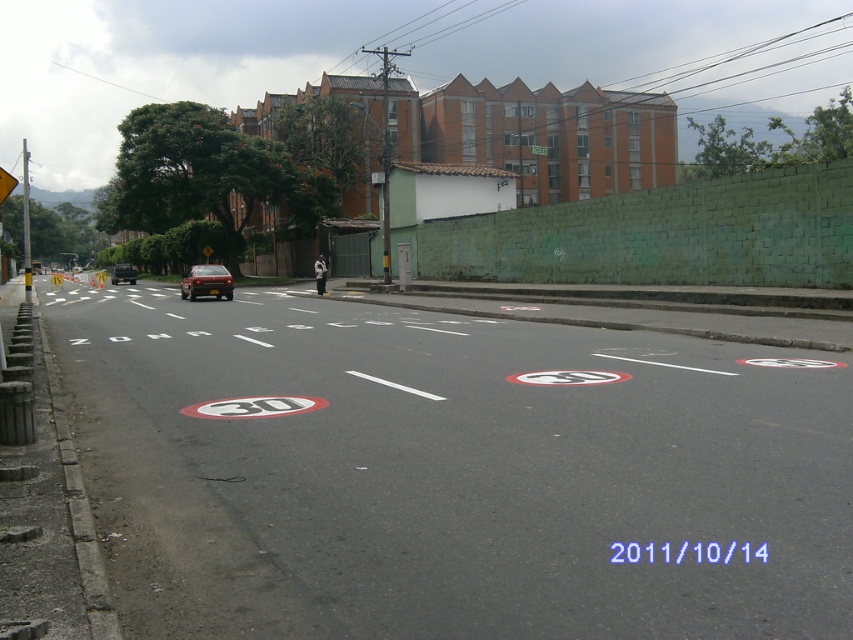
Between shiny metallic car at center and green plastic traffic sign at upper center, which one is positioned lower?

shiny metallic car at center is below.

Who is more distant from viewer, (184, 285) or (537, 148)?

Positioned behind is point (537, 148).

I want to click on shiny metallic car at center, so click(x=206, y=282).

The width and height of the screenshot is (853, 640). I want to click on shiny metallic car at center, so click(x=206, y=282).

Which is in front, point (206, 264) or point (111, 282)?

Positioned in front is point (206, 264).

You are a GUI agent. You are given a task and a screenshot of the screen. Output one action in this format:
    pyautogui.click(x=<x>, y=<y>)
    Task: Click on the shiny metallic car at center
    The height and width of the screenshot is (640, 853).
    Given the screenshot: What is the action you would take?
    pyautogui.click(x=206, y=282)

Is the position of shiny black sedan at center more distant than that of green plastic traffic sign at upper center?

No, shiny black sedan at center is closer to the viewer.

Can you confirm if shiny black sedan at center is positioned to the right of green plastic traffic sign at upper center?

No, shiny black sedan at center is not to the right of green plastic traffic sign at upper center.

Identify the location of shiny black sedan at center. (123, 273).